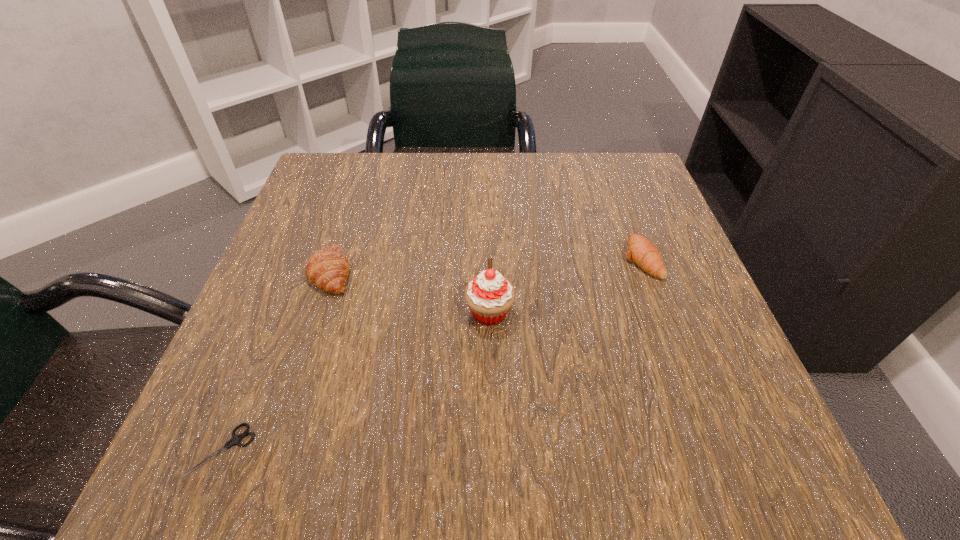
You are a GUI agent. You are given a task and a screenshot of the screen. Output one action in this format:
    pyautogui.click(x=<x>, y=<y>)
    Task: Click on the free space at the right edge
    
    Given the screenshot: What is the action you would take?
    pyautogui.click(x=682, y=276)

This screenshot has width=960, height=540. I want to click on free point at the far left corner, so click(x=364, y=197).

This screenshot has height=540, width=960. What are the coordinates of `free spot at the near left corner of the desktop` in the screenshot? It's located at (229, 427).

Locate an element on the screen. This screenshot has height=540, width=960. free region at the far right corner of the desktop is located at coordinates point(575,169).

I want to click on empty space that is in between the rightmost object and the nearest object, so click(x=431, y=355).

Locate an element on the screen. Image resolution: width=960 pixels, height=540 pixels. free space between the third tallest object and the nearest object is located at coordinates (431, 355).

I want to click on free space between the nearest object and the second tallest object, so click(276, 361).

Locate an element on the screen. The image size is (960, 540). vacant space in between the shears and the second object from right to left is located at coordinates 355,382.

The image size is (960, 540). I want to click on free point between the right crescent roll and the second object from right to left, so click(564, 286).

You are a GUI agent. You are given a task and a screenshot of the screen. Output one action in this format:
    pyautogui.click(x=<x>, y=<y>)
    Task: Click on the free area in between the nearest object and the third shortest object
    The image size is (960, 540).
    Given the screenshot: What is the action you would take?
    pyautogui.click(x=276, y=361)